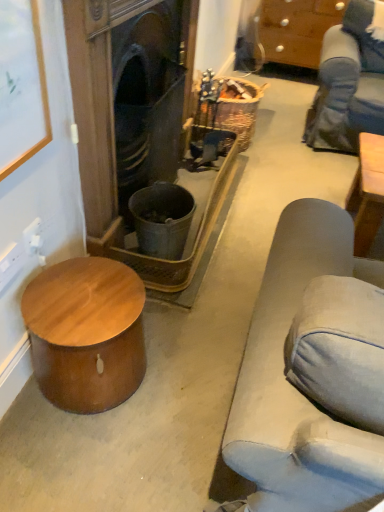
Question: In terms of width, does dark wood fireplace at center look wider or thinner when compared to wooden picture frame at upper left?

Choices:
 (A) thin
 (B) wide

Answer: (B)

Question: Based on their positions, is dark wood fireplace at center located to the left or right of wooden picture frame at upper left?

Choices:
 (A) right
 (B) left

Answer: (A)

Question: Considering the real-world distances, which object is farthest from the dark wood fireplace at center?

Choices:
 (A) wooden picture frame at upper left
 (B) brown wood cabinet at upper right
 (C) wooden drum at lower left

Answer: (B)

Question: Considering the real-world distances, which object is closest to the wooden picture frame at upper left?

Choices:
 (A) dark wood fireplace at center
 (B) brown wood cabinet at upper right
 (C) wooden drum at lower left

Answer: (A)